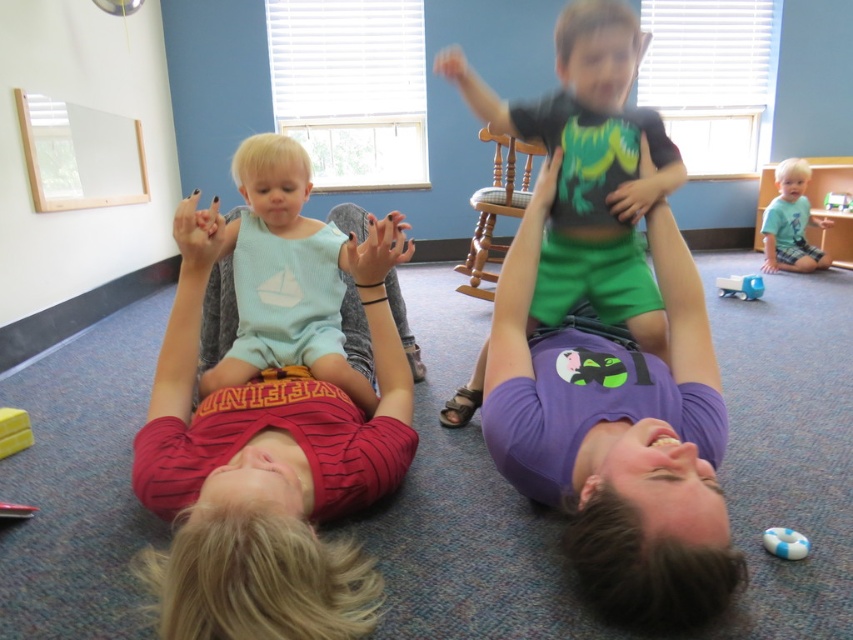
Question: Among these objects, which one is farthest from the camera?

Choices:
 (A) blue plastic toy car at center
 (B) wooden rocking chair at upper center
 (C) light blue jersey at center

Answer: (A)

Question: From the image, what is the correct spatial relationship of light blue jersey at center in relation to blue plastic toy car at center?

Choices:
 (A) left
 (B) right

Answer: (A)

Question: Observing the image, what is the correct spatial positioning of wooden rocking chair at upper center in reference to blue plastic toy car at center?

Choices:
 (A) above
 (B) below

Answer: (A)

Question: Does yellow rubber toy at lower left have a greater width compared to blue plastic toy car at center?

Choices:
 (A) no
 (B) yes

Answer: (A)

Question: Among these objects, which one is farthest from the camera?

Choices:
 (A) light blue cotton shirt at lower right
 (B) blue rubber ring at lower right

Answer: (A)

Question: Which of these objects is positioned farthest from the blue plastic toy car at center?

Choices:
 (A) light blue cotton shirt at lower right
 (B) light blue jersey at center
 (C) wooden rocking chair at upper center
 (D) yellow rubber toy at lower left

Answer: (D)